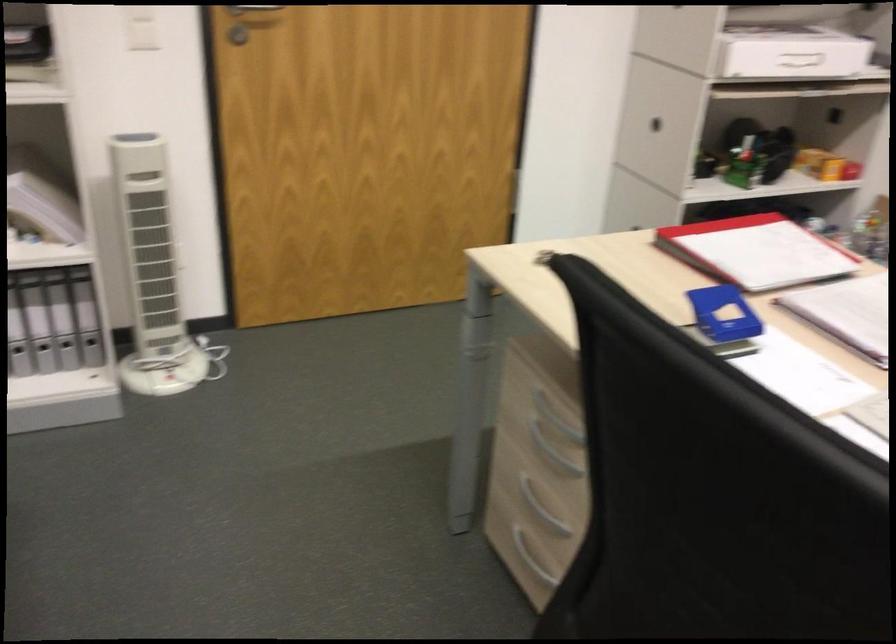
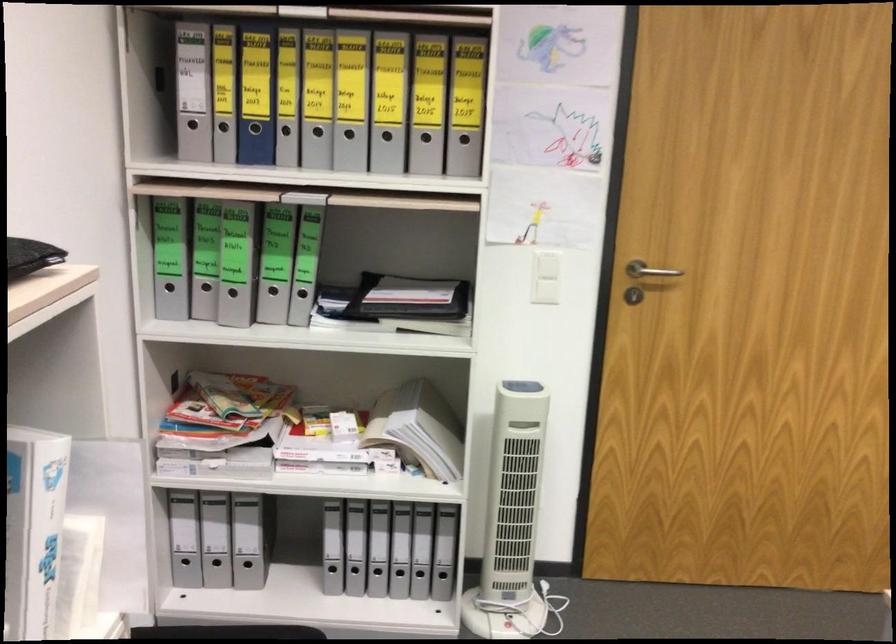
Question: How did the camera likely rotate?

Choices:
 (A) Left
 (B) Right
 (C) Up
 (D) Down

Answer: (A)